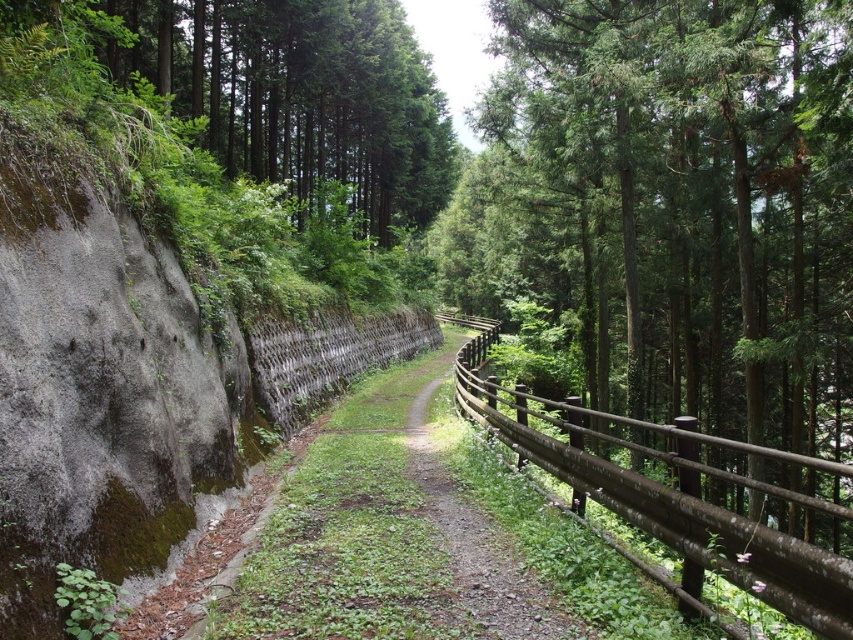
Question: Which of the following is the farthest from the observer?

Choices:
 (A) (601, 147)
 (B) (718, 557)
 (C) (351, 339)
 (D) (532, 605)

Answer: (C)

Question: Does green textured fence at right have a greater width compared to wooden fence at center?

Choices:
 (A) no
 (B) yes

Answer: (B)

Question: Is green textured fence at right smaller than wooden fence at center?

Choices:
 (A) yes
 (B) no

Answer: (B)

Question: Can you confirm if green textured fence at right is wider than brown wooden fence at right?

Choices:
 (A) yes
 (B) no

Answer: (A)

Question: Estimate the real-world distances between objects in this image. Which object is farther from the brown wooden trail at center?

Choices:
 (A) wooden fence at center
 (B) green textured fence at right

Answer: (B)

Question: Which object is positioned closest to the wooden fence at center?

Choices:
 (A) brown wooden trail at center
 (B) brown wooden fence at right
 (C) green textured fence at right

Answer: (B)